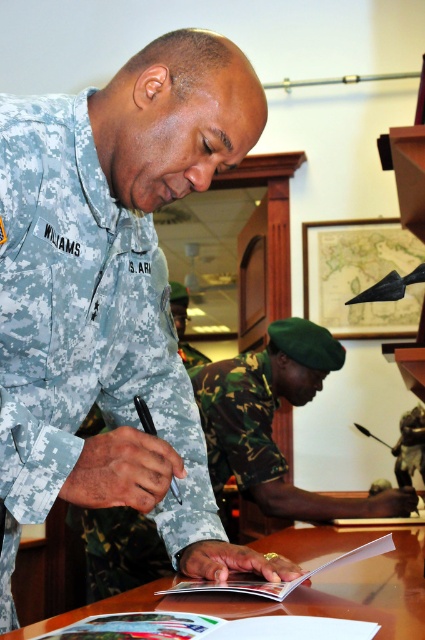
You are an observer in the scene. You notice the camouflage uniform at center and the brown wooden table at center. Which object takes up more space in the image?

The brown wooden table at center takes up more space in the image because it is larger than the camouflage uniform at center.

You are a photographer standing 3 feet away from the camouflage fabric uniform at center. You need to take a photo of the uniform without moving closer. Is your camera within reach to focus on the uniform?

The camouflage fabric uniform at center and camera are 27.89 inches apart. Since the photographer is 3 feet away, which is 36 inches, the camera is within reach to focus on the uniform as the distance between them is less than the photographer distance.